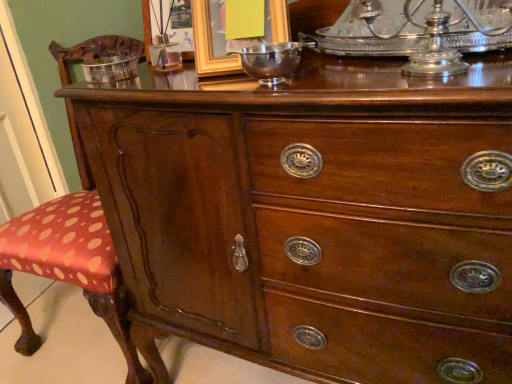
Question: From the image's perspective, is gold metallic picture frame at upper center, arranged as the 1th picture frame when viewed from the right, located above or below silver metallic bowl at upper left?

Choices:
 (A) above
 (B) below

Answer: (A)

Question: Is gold metallic picture frame at upper center, arranged as the 1th picture frame when viewed from the right, bigger or smaller than silver metallic bowl at upper left?

Choices:
 (A) small
 (B) big

Answer: (B)

Question: Estimate the real-world distances between objects in this image. Which object is closer to the metallic gold picture frame at upper center, the second picture frame from the right?

Choices:
 (A) gold metallic picture frame at upper center, acting as the 2th picture frame starting from the left
 (B) shiny silver bowl at center
 (C) silver metallic bowl at upper left

Answer: (C)

Question: Which is nearer to the silver metallic bowl at upper left?

Choices:
 (A) shiny silver bowl at center
 (B) metallic gold picture frame at upper center, the second picture frame from the right
 (C) gold metallic picture frame at upper center, acting as the 2th picture frame starting from the left

Answer: (B)